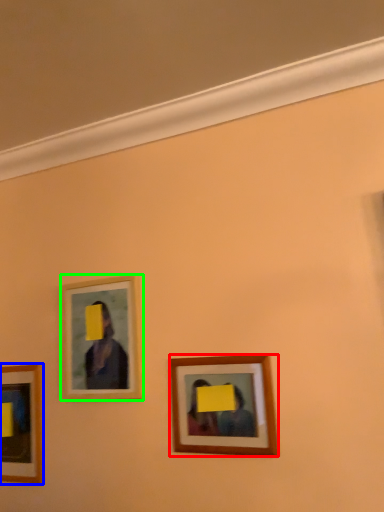
Question: Which object is the farthest from picture frame (highlighted by a red box)? Choose among these: picture frame (highlighted by a blue box) or picture frame (highlighted by a green box).

Choices:
 (A) picture frame
 (B) picture frame

Answer: (A)